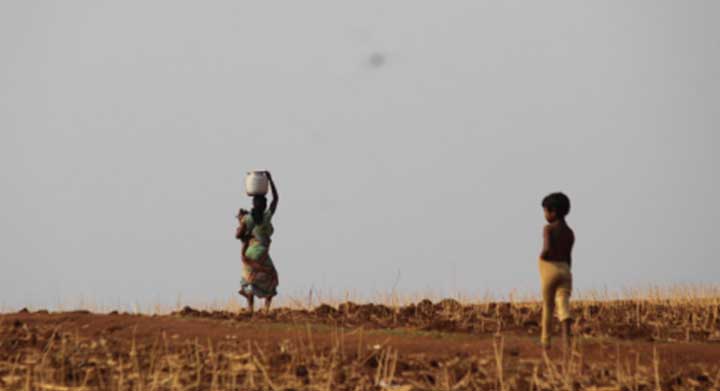
Identify the location of bucket. (256, 187).